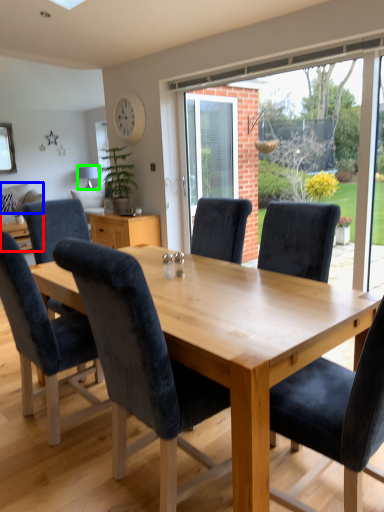
Question: Based on their relative distances, which object is farther from studio couch (highlighted by a red box)? Choose from pillow (highlighted by a blue box) and lamp (highlighted by a green box).

Choices:
 (A) pillow
 (B) lamp

Answer: (B)